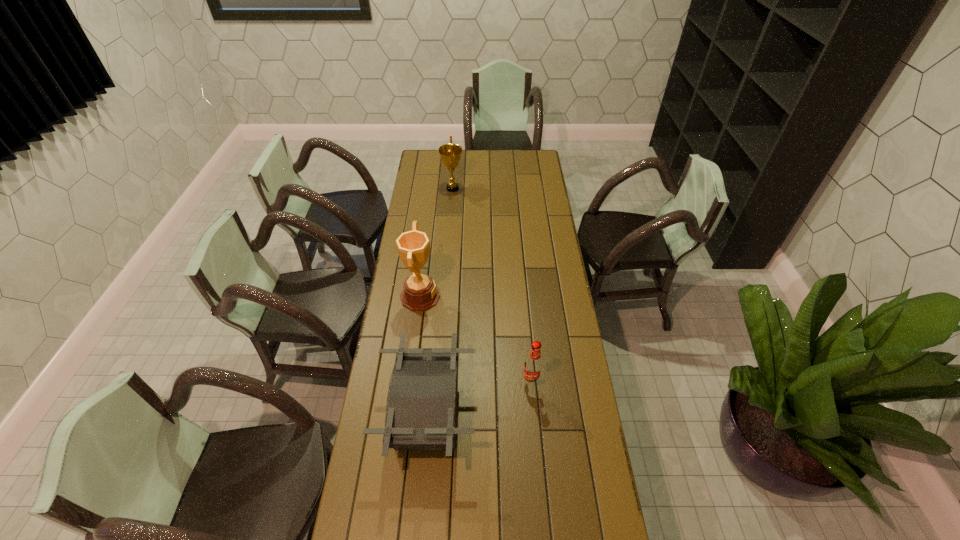
At what (x,y) coordinates should I click in order to perform the action: click on vacant region that satisfies the following two spatial constraints: 1. on the back side of the rightmost object; 2. on the front view with handles of the farthest object. Please return your answer as a coordinate pair (x, y). The width and height of the screenshot is (960, 540). Looking at the image, I should click on (514, 188).

You are a GUI agent. You are given a task and a screenshot of the screen. Output one action in this format:
    pyautogui.click(x=<x>, y=<y>)
    Task: Click on the free space that satisfies the following two spatial constraints: 1. on the front view with handles of the second tallest object; 2. on the right side of the root beer
    This screenshot has height=540, width=960.
    Given the screenshot: What is the action you would take?
    pyautogui.click(x=438, y=382)

At what (x,y) coordinates should I click in order to perform the action: click on vacant space that satisfies the following two spatial constraints: 1. on the front-facing side of the third nearest object; 2. on the left side of the rightmost object. Please return your answer as a coordinate pair (x, y). Looking at the image, I should click on (410, 382).